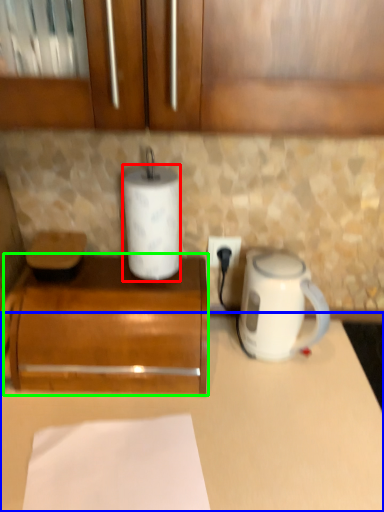
Question: Considering the real-world distances, which object is farthest from paper towel (highlighted by a red box)? counter (highlighted by a blue box) or cabinetry (highlighted by a green box)?

Choices:
 (A) counter
 (B) cabinetry

Answer: (A)